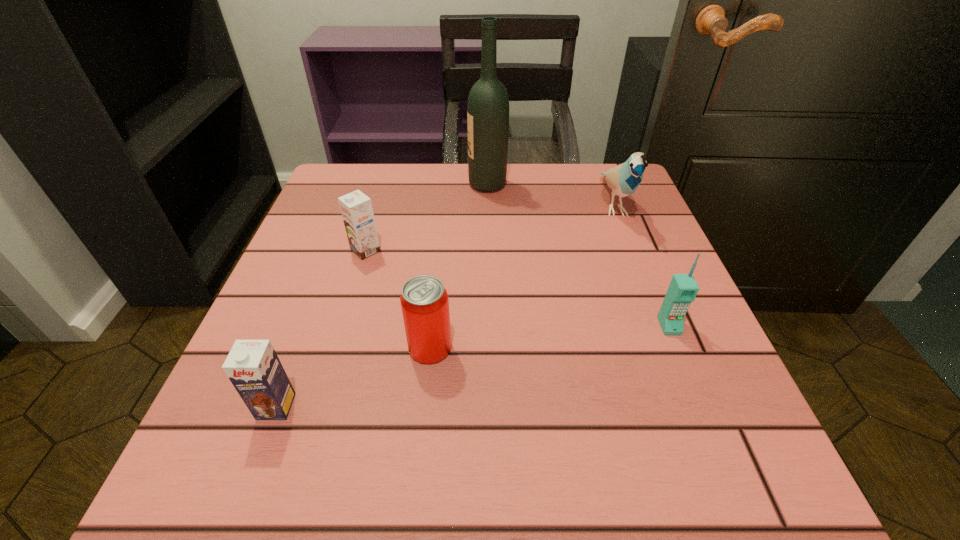
Identify the location of cellular telephone that is positioned at the right edge. (683, 288).

The width and height of the screenshot is (960, 540). I want to click on object located at the far right corner, so click(624, 179).

I want to click on free space at the far edge of the desktop, so click(534, 197).

You are a GUI agent. You are given a task and a screenshot of the screen. Output one action in this format:
    pyautogui.click(x=<x>, y=<y>)
    Task: Click on the vacant space at the left edge
    The width and height of the screenshot is (960, 540).
    Given the screenshot: What is the action you would take?
    pyautogui.click(x=306, y=236)

In order to click on vacant area at the right edge of the desktop in this screenshot , I will do `click(706, 341)`.

The height and width of the screenshot is (540, 960). I want to click on vacant space at the far left corner, so click(x=372, y=199).

In the image, there is a desktop. At what (x,y) coordinates should I click in order to perform the action: click on blank space at the far right corner. Please return your answer as a coordinate pair (x, y). The width and height of the screenshot is (960, 540). Looking at the image, I should click on (586, 188).

Image resolution: width=960 pixels, height=540 pixels. Identify the location of free location at the near right corner. (676, 506).

This screenshot has width=960, height=540. Identify the location of vacant area that lies between the fourth object from right to left and the fourth nearest object. (397, 299).

At what (x,y) coordinates should I click in order to perform the action: click on free space that is in between the cellular telephone and the leftmost object. Please return your answer as a coordinate pair (x, y). This screenshot has width=960, height=540. Looking at the image, I should click on (472, 366).